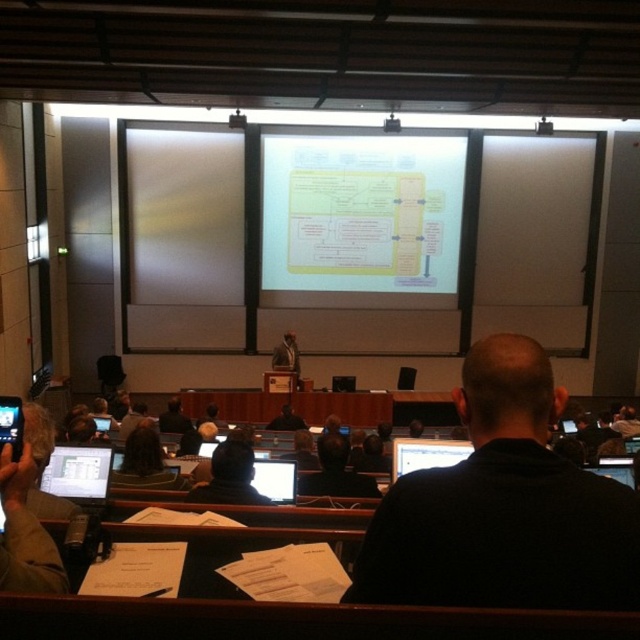
Based on the photo, you are an attendee at the lecture hall and need to place a small notebook on the nearest surface. You see the black fabric at center and the gray fabric laptop at lower left. Which surface can you use, and why?

You can place the notebook on the gray fabric laptop at lower left because the black fabric at center is shorter than the gray fabric laptop at lower left, meaning the laptop is higher and more accessible for placing items.

You are organizing a tech conference and need to ensure all devices are visible to the audience. The matte black laptop at lower left and the dark blue shirt at center are both on the stage. Which object is smaller in size?

The matte black laptop at lower left is smaller in size compared to the dark blue shirt at center according to the description.

You are organizing a workshop and need to ensure that the laptop fits on a table that can only accommodate items narrower than the dark blue shirt at center. Can the matte black laptop at lower left fit on the table?

The matte black laptop at lower left has a width less than the dark blue shirt at center, so it can fit on the table.